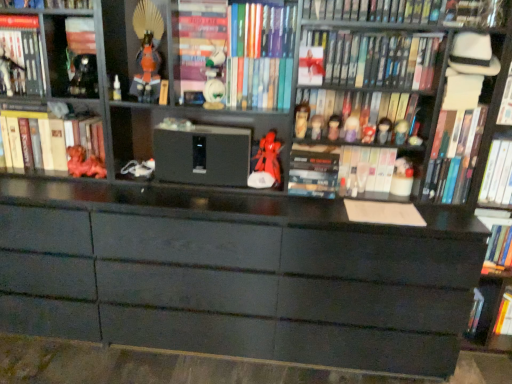
Find the location of a particular element. vacant space situated above matte black book at upper left, which is the 1th book in left-to-right order (from a real-world perspective) is located at coordinates (18, 27).